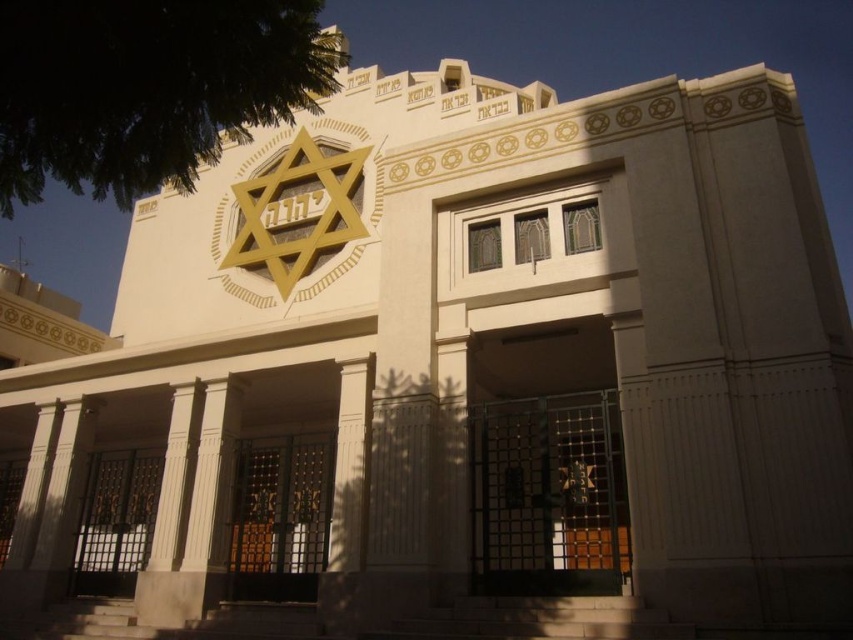
Question: Is metallic gate at center positioned at the back of wooden gate at center?

Choices:
 (A) yes
 (B) no

Answer: (B)

Question: Which point is farther to the camera?

Choices:
 (A) (614, 480)
 (B) (244, 529)

Answer: (B)

Question: Which point is farther to the camera?

Choices:
 (A) (538, 579)
 (B) (239, 566)

Answer: (B)

Question: Is metallic gate at center below wooden gate at center?

Choices:
 (A) yes
 (B) no

Answer: (B)

Question: Is metallic gate at center positioned behind wooden gate at center?

Choices:
 (A) yes
 (B) no

Answer: (B)